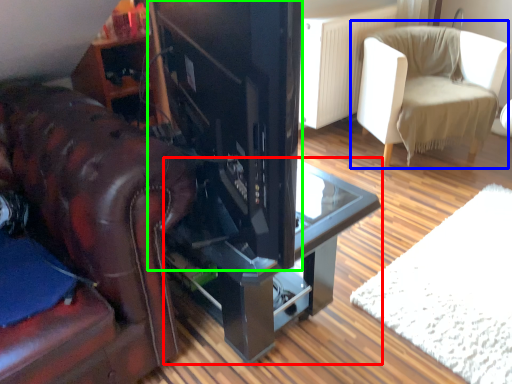
Question: Considering the real-world distances, which object is closest to table (highlighted by a red box)? chair (highlighted by a blue box) or appliance (highlighted by a green box).

Choices:
 (A) chair
 (B) appliance

Answer: (B)